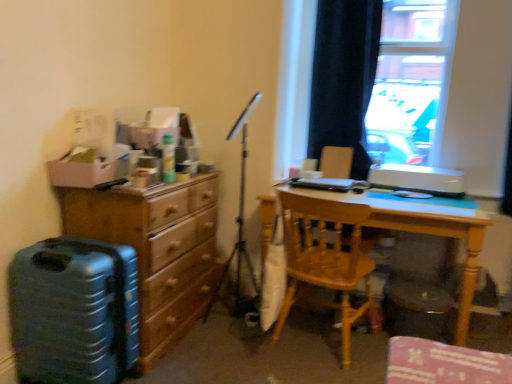
Question: From the image's perspective, relative to wooden chest of drawers at left, is transparent glass window at upper right above or below?

Choices:
 (A) below
 (B) above

Answer: (B)

Question: Is point (424, 158) positioned closer to the camera than point (94, 206)?

Choices:
 (A) closer
 (B) farther

Answer: (B)

Question: Which of these objects is positioned farthest from the wooden chair at center?

Choices:
 (A) transparent glass window at upper right
 (B) light wood desk at center
 (C) wooden chest of drawers at left
 (D) dark velvet curtain at upper right
 (E) teal plastic suitcase at left

Answer: (A)

Question: Which object is positioned closest to the wooden chest of drawers at left?

Choices:
 (A) metallic tripod at center
 (B) wooden chair at center
 (C) transparent glass window at upper right
 (D) dark velvet curtain at upper right
 (E) light wood desk at center

Answer: (A)